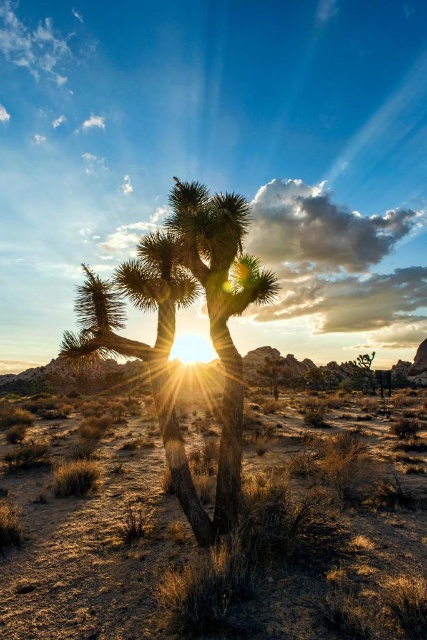
You are planning to plant a new tree in the desert. The smooth brown palm tree at center is already present. Given that the brown textured desert at center has more space, can you fit another palm tree of the same size next to the existing one?

The brown textured desert at center has a larger size compared to the smooth brown palm tree at center, so yes, there is enough space to plant another palm tree of the same size next to the existing one.

You are an environmental scientist analyzing the desert ecosystem. You observe the brown textured desert at center and the smooth brown palm tree at center. Which of these two objects is taller?

The smooth brown palm tree at center is taller than the brown textured desert at center.